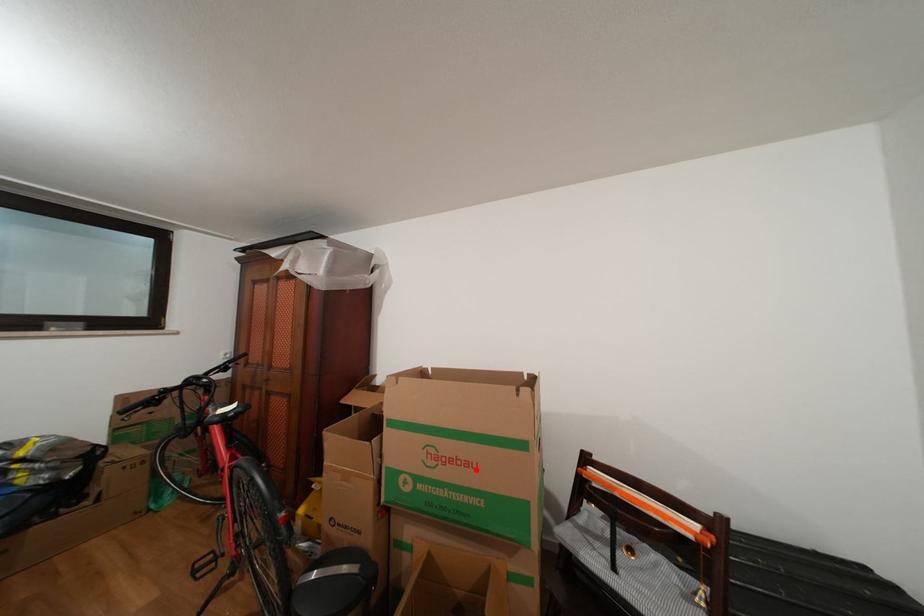
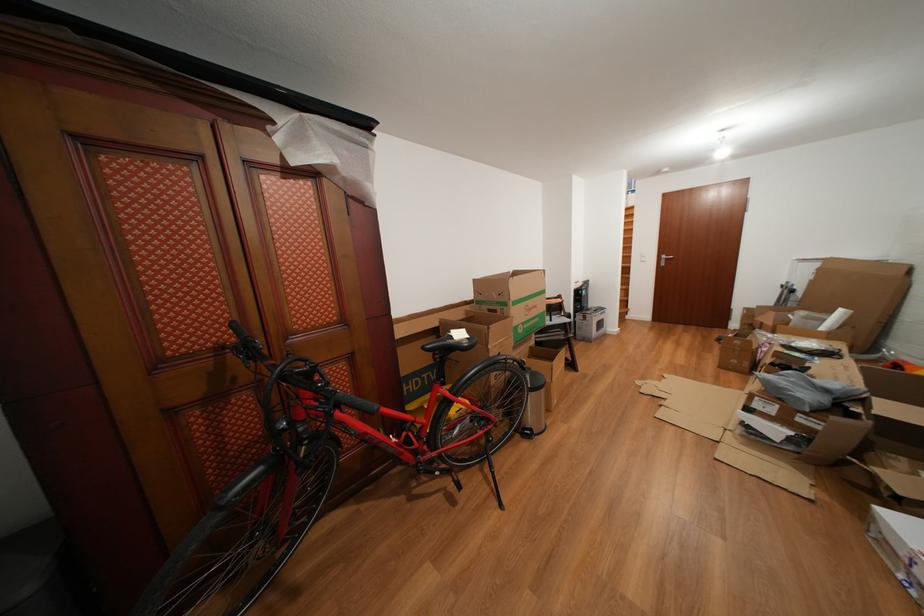
Locate, in the second image, the point that corresponds to the highlighted location in the first image.

(543, 312)